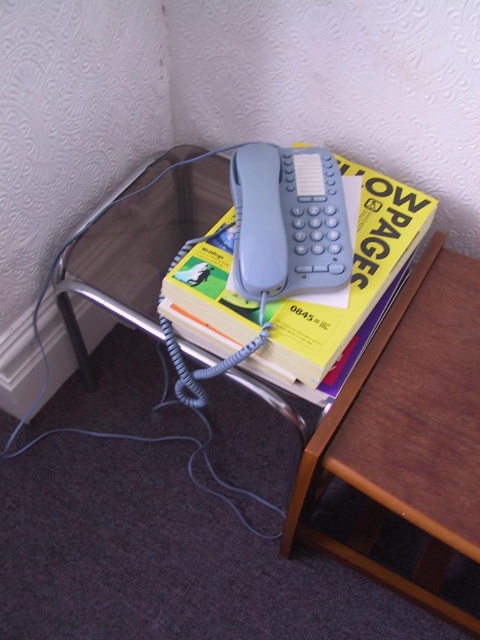
You are organizing a library and need to place a new book that requires a specific location. The book must be placed at the point with coordinates (347, 289). Where should you place the book?

The yellow paperbacks at center are located at point (347, 289), so you should place the new book there.

You are organizing the items on the table and want to place a new item between the yellow paperbacks at center and the matte gray phone at center. Is there space between them?

The yellow paperbacks at center is located below the matte gray phone at center, so there is space between them for placing a new item.